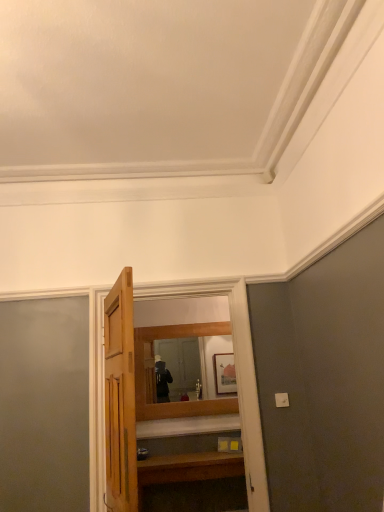
Question: From the image's perspective, is wooden vanity at lower center beneath wooden mirror at center?

Choices:
 (A) yes
 (B) no

Answer: (A)

Question: Can you confirm if wooden vanity at lower center is smaller than wooden mirror at center?

Choices:
 (A) no
 (B) yes

Answer: (A)

Question: From the image's perspective, is wooden vanity at lower center over wooden mirror at center?

Choices:
 (A) no
 (B) yes

Answer: (A)

Question: From a real-world perspective, is wooden vanity at lower center physically below wooden mirror at center?

Choices:
 (A) no
 (B) yes

Answer: (B)

Question: Is wooden vanity at lower center looking in the opposite direction of wooden mirror at center?

Choices:
 (A) yes
 (B) no

Answer: (B)

Question: From their relative heights in the image, would you say wooden mirror at center is taller or shorter than wooden door at center?

Choices:
 (A) tall
 (B) short

Answer: (B)

Question: Is wooden mirror at center wider or thinner than wooden door at center?

Choices:
 (A) thin
 (B) wide

Answer: (A)

Question: From the image's perspective, is wooden mirror at center above or below wooden door at center?

Choices:
 (A) above
 (B) below

Answer: (B)

Question: Which is correct: wooden mirror at center is inside wooden door at center, or outside of it?

Choices:
 (A) inside
 (B) outside

Answer: (B)

Question: Looking at their shapes, would you say wooden mirror at center is wider or thinner than wooden vanity at lower center?

Choices:
 (A) wide
 (B) thin

Answer: (B)

Question: Visually, is wooden mirror at center positioned to the left or to the right of wooden vanity at lower center?

Choices:
 (A) right
 (B) left

Answer: (B)

Question: Does point (150, 403) appear closer or farther from the camera than point (162, 498)?

Choices:
 (A) farther
 (B) closer

Answer: (A)

Question: Choose the correct answer: Is wooden mirror at center inside wooden vanity at lower center or outside it?

Choices:
 (A) inside
 (B) outside

Answer: (B)

Question: Looking at their shapes, would you say wooden door at center is wider or thinner than wooden vanity at lower center?

Choices:
 (A) thin
 (B) wide

Answer: (A)

Question: From their relative heights in the image, would you say wooden door at center is taller or shorter than wooden vanity at lower center?

Choices:
 (A) short
 (B) tall

Answer: (B)